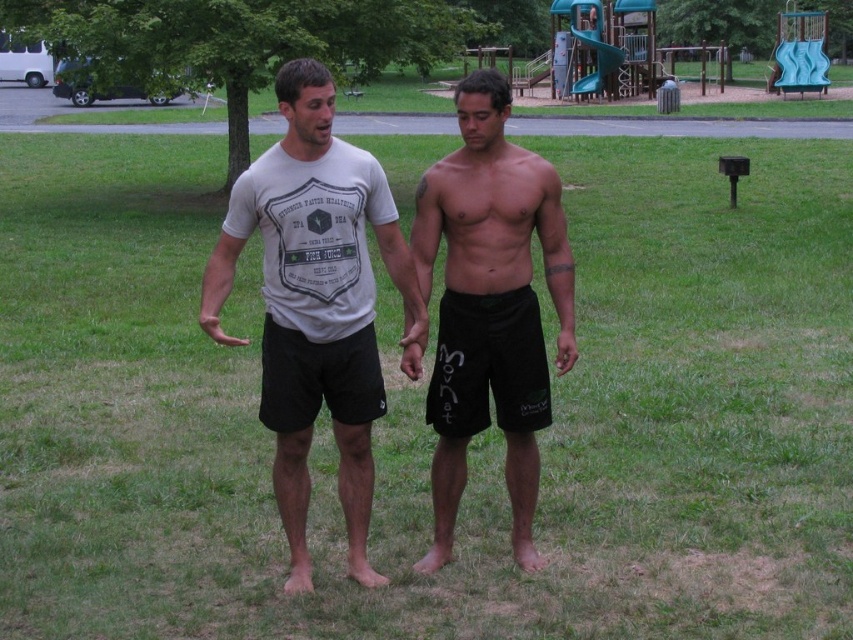
Question: Is white cotton t-shirt at center closer to camera compared to black matte shorts at center?

Choices:
 (A) no
 (B) yes

Answer: (B)

Question: Does white cotton t-shirt at center have a larger size compared to black matte shorts at center?

Choices:
 (A) yes
 (B) no

Answer: (A)

Question: Can you confirm if white cotton t-shirt at center is bigger than black matte shorts at center?

Choices:
 (A) yes
 (B) no

Answer: (A)

Question: Among these objects, which one is nearest to the camera?

Choices:
 (A) white cotton t-shirt at center
 (B) black matte shorts at center

Answer: (A)